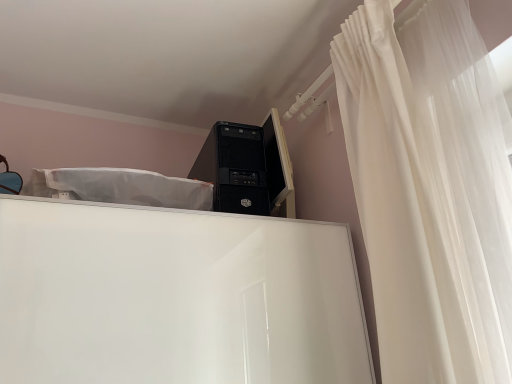
Question: Does matte black monitor at upper right have a smaller size compared to white sheer curtain at upper right?

Choices:
 (A) yes
 (B) no

Answer: (A)

Question: Can you confirm if matte black monitor at upper right is positioned to the left of white sheer curtain at upper right?

Choices:
 (A) yes
 (B) no

Answer: (A)

Question: From a real-world perspective, is matte black monitor at upper right physically below white sheer curtain at upper right?

Choices:
 (A) no
 (B) yes

Answer: (A)

Question: Is matte black monitor at upper right facing away from white sheer curtain at upper right?

Choices:
 (A) yes
 (B) no

Answer: (B)

Question: Is matte black monitor at upper right behind white sheer curtain at upper right?

Choices:
 (A) no
 (B) yes

Answer: (B)

Question: Is matte black monitor at upper right closer to camera compared to white sheer curtain at upper right?

Choices:
 (A) yes
 (B) no

Answer: (B)

Question: Does white sheer curtain at upper right have a lesser width compared to matte black monitor at upper right?

Choices:
 (A) yes
 (B) no

Answer: (B)

Question: Does white sheer curtain at upper right appear on the right side of matte black monitor at upper right?

Choices:
 (A) yes
 (B) no

Answer: (A)

Question: Is white sheer curtain at upper right shorter than matte black monitor at upper right?

Choices:
 (A) yes
 (B) no

Answer: (B)

Question: Considering the relative sizes of white sheer curtain at upper right and matte black monitor at upper right in the image provided, is white sheer curtain at upper right wider than matte black monitor at upper right?

Choices:
 (A) no
 (B) yes

Answer: (B)

Question: Can you confirm if white sheer curtain at upper right is bigger than matte black monitor at upper right?

Choices:
 (A) no
 (B) yes

Answer: (B)

Question: From the image's perspective, is white sheer curtain at upper right located above matte black monitor at upper right?

Choices:
 (A) no
 (B) yes

Answer: (A)

Question: From a real-world perspective, is matte black monitor at upper right over black matte desktop computer at upper center?

Choices:
 (A) no
 (B) yes

Answer: (B)